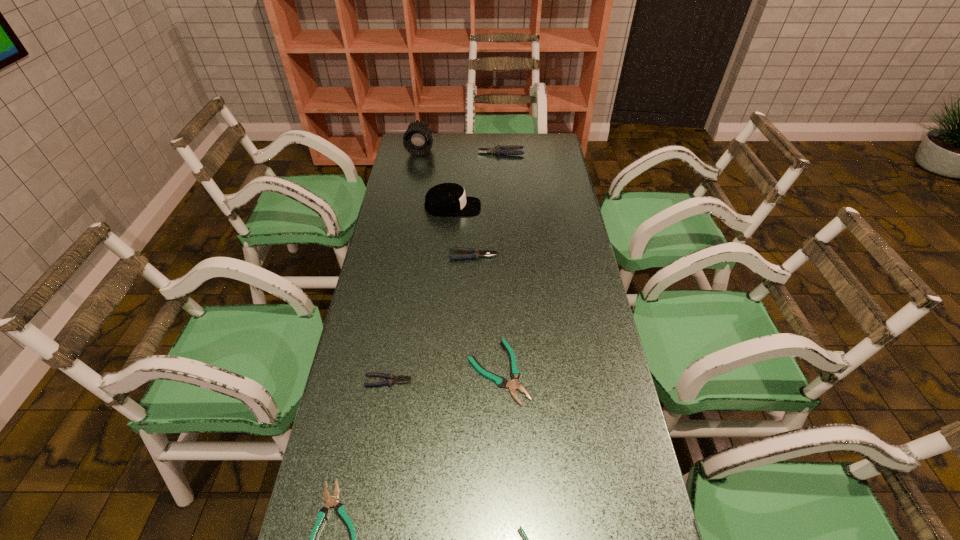
You are a GUI agent. You are given a task and a screenshot of the screen. Output one action in this format:
    pyautogui.click(x=<x>, y=<y>)
    Task: Click on the vacant area that lies between the second nearest gray pliers and the cap
    This screenshot has width=960, height=540.
    Given the screenshot: What is the action you would take?
    pyautogui.click(x=463, y=231)

Image resolution: width=960 pixels, height=540 pixels. I want to click on free point between the black telephoto lens and the nearest gray pliers, so click(x=404, y=265).

The width and height of the screenshot is (960, 540). Identify the location of free space between the fourth farthest object and the black cap. (463, 231).

Where is `empty space that is in between the smallest gray pliers and the farthest gray pliers`? The image size is (960, 540). empty space that is in between the smallest gray pliers and the farthest gray pliers is located at coordinates (444, 267).

Locate which object is the fourth closest to the telephoto lens. Please provide its 2D coordinates. Your answer should be formatted as a tuple, i.e. [(x, y)], where the tuple contains the x and y coordinates of a point satisfying the conditions above.

[(513, 385)]

The height and width of the screenshot is (540, 960). Find the location of `the fifth closest object to the fifth nearest object`. the fifth closest object to the fifth nearest object is located at coordinates (417, 140).

Where is `the closest pliers to the sixth tallest object`? the closest pliers to the sixth tallest object is located at coordinates (391, 378).

At what (x,y) coordinates should I click in order to perform the action: click on pliers that can be found as the second closest to the shortest pliers. Please return your answer as a coordinate pair (x, y). This screenshot has height=540, width=960. Looking at the image, I should click on (513, 385).

Locate an element on the screen. The image size is (960, 540). gray pliers that stands as the closest to the fifth tallest pliers is located at coordinates (391, 378).

Point out which gray pliers is positioned as the third nearest to the leftmost teal pliers. Please provide its 2D coordinates. Your answer should be formatted as a tuple, i.e. [(x, y)], where the tuple contains the x and y coordinates of a point satisfying the conditions above.

[(507, 150)]